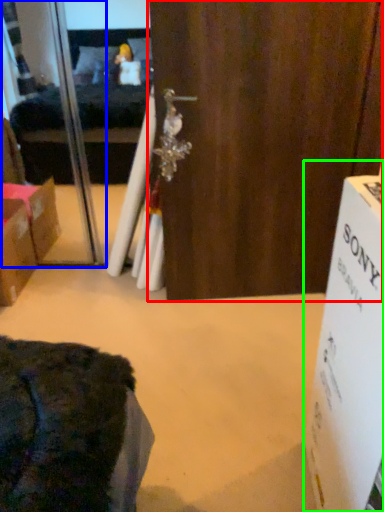
Question: Considering the real-world distances, which object is closest to door (highlighted by a red box)? screen door (highlighted by a blue box) or cardboard box (highlighted by a green box).

Choices:
 (A) screen door
 (B) cardboard box

Answer: (A)